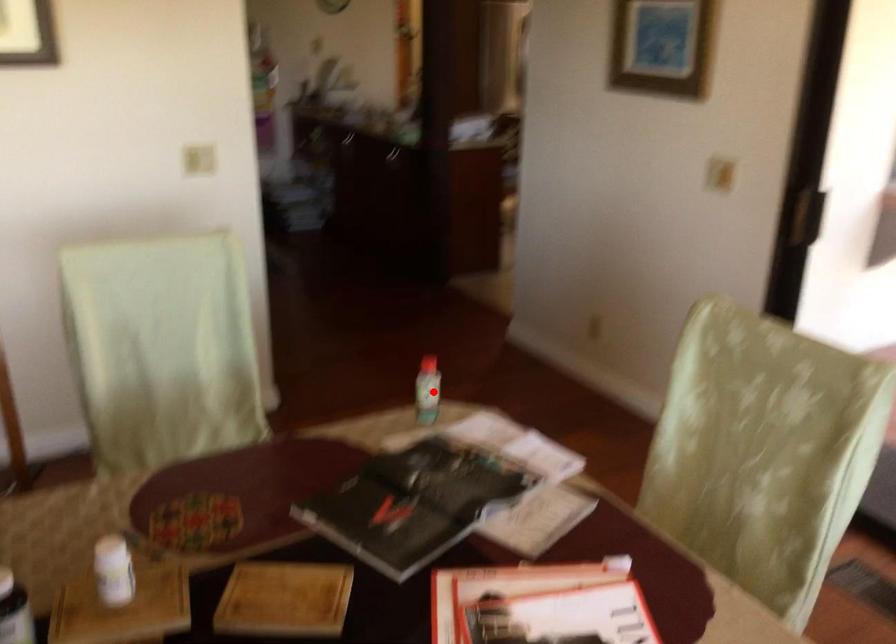
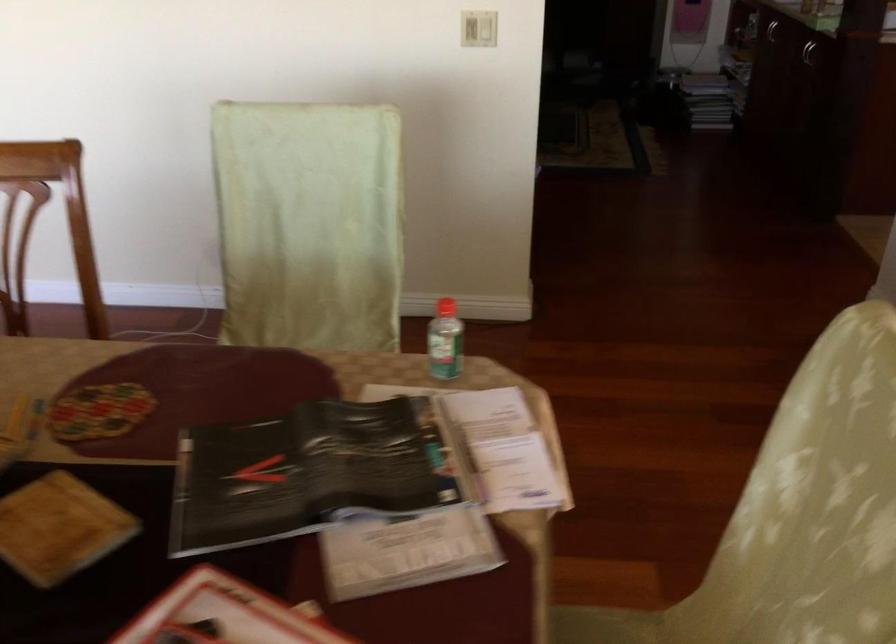
Question: I am providing you with two images of the same scene from different viewpoints. In image1, a red point is highlighted. Considering the same 3D point in image2, which of the following is correct?

Choices:
 (A) It is closer
 (B) It is farther

Answer: (A)